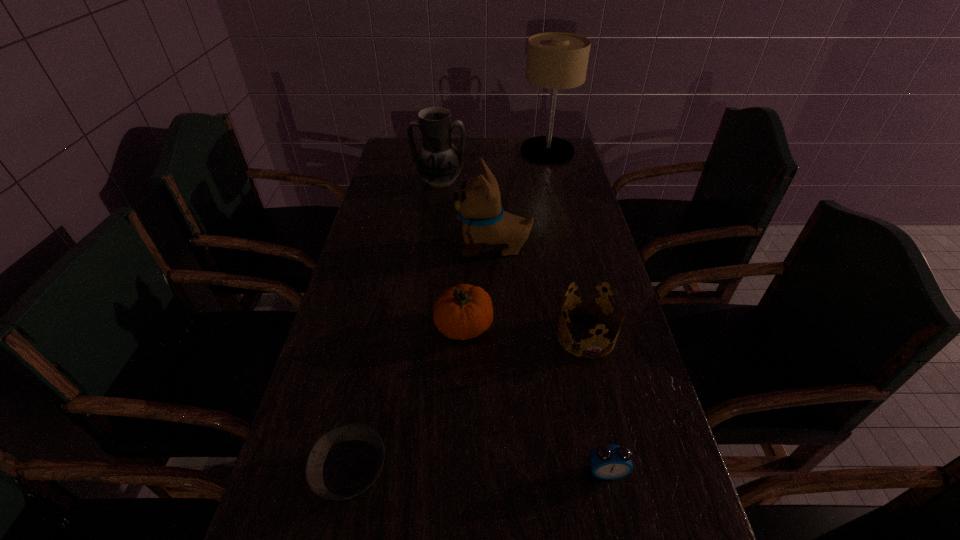
Find the location of `crown at the right edge`. crown at the right edge is located at coordinates (595, 297).

Identify the location of alarm clock located at the right edge. (609, 462).

Where is `object that is positioned at the far right corner`? The image size is (960, 540). object that is positioned at the far right corner is located at coordinates (555, 60).

At what (x,y) coordinates should I click in order to perform the action: click on vacant space at the left edge. Please return your answer as a coordinate pair (x, y). Looking at the image, I should click on (381, 390).

Identify the location of blank space at the right edge of the desktop. This screenshot has width=960, height=540. (619, 334).

Find the location of a particular element. free space at the far left corner of the desktop is located at coordinates (384, 165).

Locate an element on the screen. Image resolution: width=960 pixels, height=540 pixels. free space that is in between the second shortest object and the third shortest object is located at coordinates (596, 403).

Where is `free space between the crown and the fifth nearest object`? The image size is (960, 540). free space between the crown and the fifth nearest object is located at coordinates (540, 292).

This screenshot has height=540, width=960. I want to click on free spot between the third farthest object and the tallest object, so click(520, 199).

This screenshot has width=960, height=540. Identify the location of vacant space that's between the alarm clock and the fourth tallest object. (536, 400).